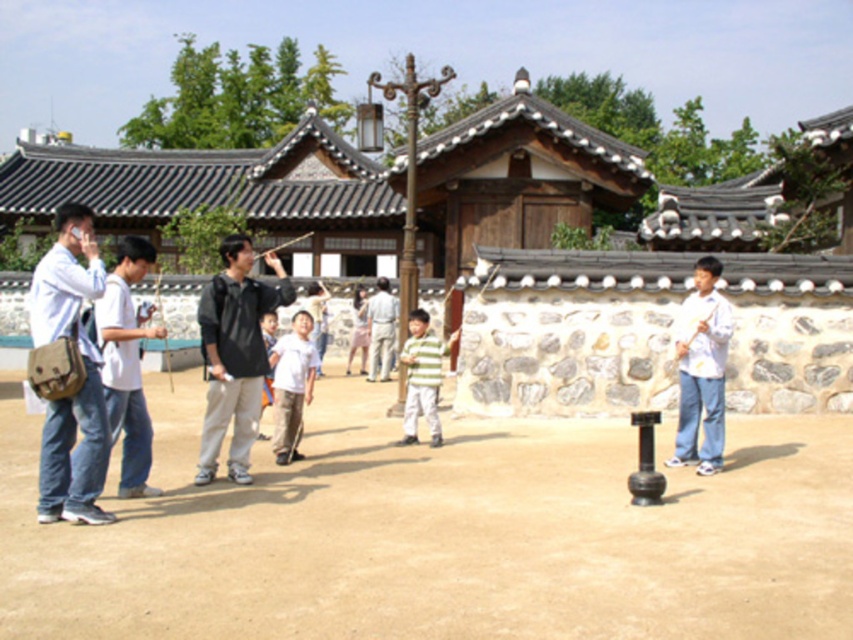
Who is positioned more to the left, denim jacket at left or pink fabric dress at center?

denim jacket at left is more to the left.

Between denim jacket at left and pink fabric dress at center, which one has more height?

denim jacket at left is taller.

What do you see at coordinates (84, 371) in the screenshot?
I see `denim jacket at left` at bounding box center [84, 371].

Identify the location of denim jacket at left. The width and height of the screenshot is (853, 640). (84, 371).

Can you confirm if white cotton shirt at center is bigger than pink fabric dress at center?

Actually, white cotton shirt at center might be smaller than pink fabric dress at center.

Who is higher up, white cotton shirt at center or pink fabric dress at center?

pink fabric dress at center is above.

Which is behind, point (305, 320) or point (358, 369)?

The point (358, 369) is more distant.

This screenshot has width=853, height=640. Find the location of `white cotton shirt at center`. white cotton shirt at center is located at coordinates (292, 385).

Is point (296, 435) behind point (370, 333)?

No.

Is white cotton shirt at center closer to the viewer compared to light gray fabric shirt at center?

Yes.

Who is more forward, (279, 339) or (376, 282)?

Point (279, 339)

Find the location of a particular element. white cotton shirt at center is located at coordinates (292, 385).